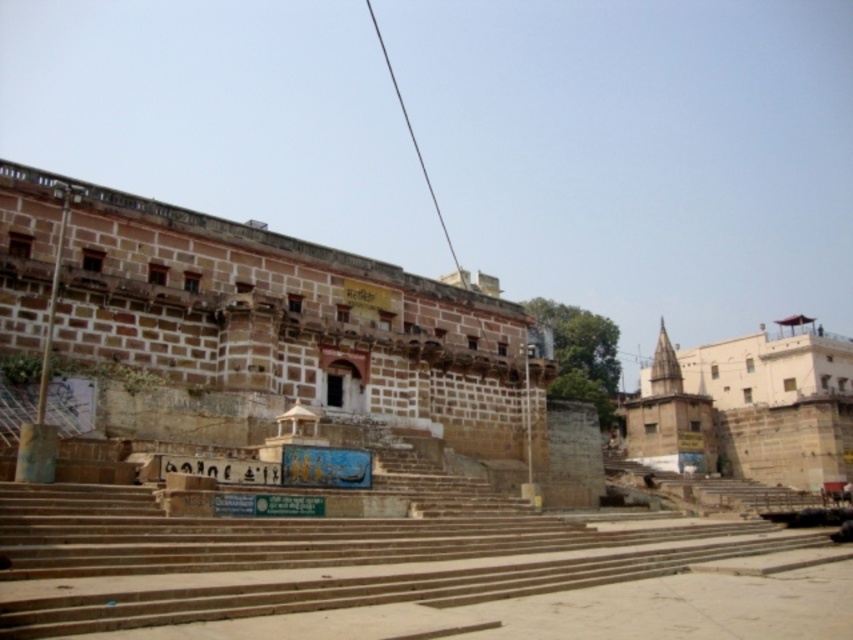
Who is higher up, brown stone stairs at center or brown stone palace at center?

Answer: Positioned higher is brown stone palace at center.

Consider the image. Is brown stone stairs at center smaller than brown stone palace at center?

Yes, brown stone stairs at center is smaller than brown stone palace at center.

Who is more distant from viewer, (563, 588) or (318, 285)?

The point (318, 285) is behind.

The width and height of the screenshot is (853, 640). Identify the location of brown stone stairs at center. (401, 573).

Does point (229, 579) come closer to viewer compared to point (660, 468)?

Yes, point (229, 579) is in front of point (660, 468).

Locate an element on the screen. The image size is (853, 640). brown stone stairs at center is located at coordinates point(401,573).

Is point (531, 468) farther from camera compared to point (821, 452)?

That is False.

Is brown stone palace at center positioned in front of beige stone temple at right?

Yes, it is.

Find the location of a particular element. Image resolution: width=853 pixels, height=640 pixels. brown stone palace at center is located at coordinates (314, 337).